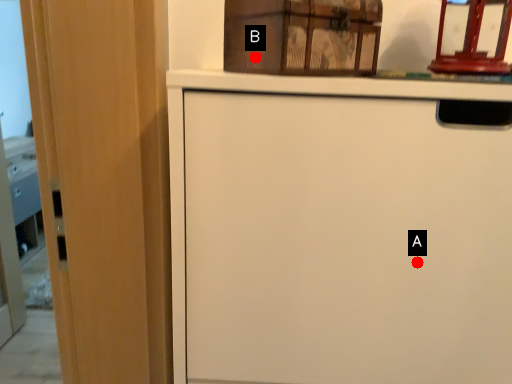
Question: Two points are circled on the image, labeled by A and B beside each circle. Which point is further to the camera?

Choices:
 (A) A is further
 (B) B is further

Answer: (A)